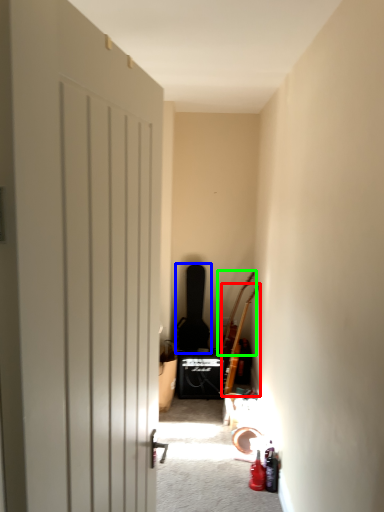
Question: Which is farther away from guitar (highlighted by a red box)? guitar (highlighted by a blue box) or guitar (highlighted by a green box)?

Choices:
 (A) guitar
 (B) guitar

Answer: (A)